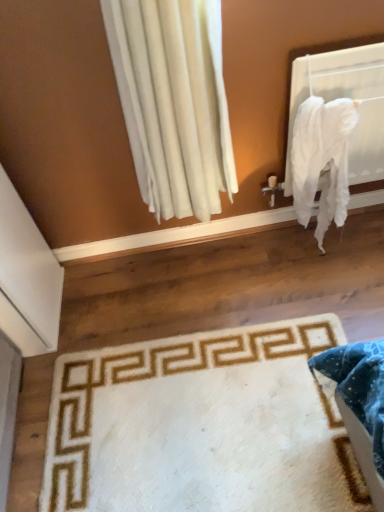
Question: From the image's perspective, is white fabric at upper right positioned above or below white plush rug at lower center?

Choices:
 (A) above
 (B) below

Answer: (A)

Question: In terms of height, does white fabric at upper right look taller or shorter compared to white plush rug at lower center?

Choices:
 (A) short
 (B) tall

Answer: (B)

Question: Which is nearer to the white fabric at upper right?

Choices:
 (A) white cotton blanket at right
 (B) white plush rug at lower center

Answer: (A)

Question: Which is nearer to the white cotton blanket at right?

Choices:
 (A) white plush rug at lower center
 (B) white fabric at upper right

Answer: (B)